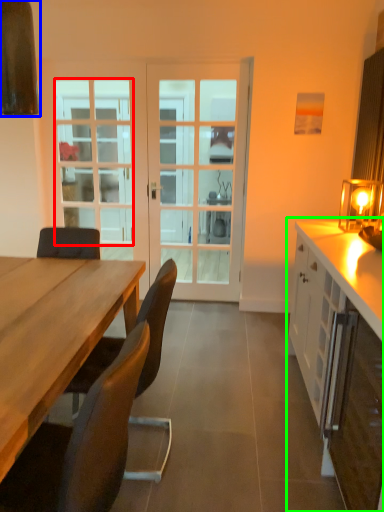
Question: Which object is the closest to the window (highlighted by a red box)? Choose among these: exhaust hood (highlighted by a blue box) or cabinetry (highlighted by a green box).

Choices:
 (A) exhaust hood
 (B) cabinetry

Answer: (A)